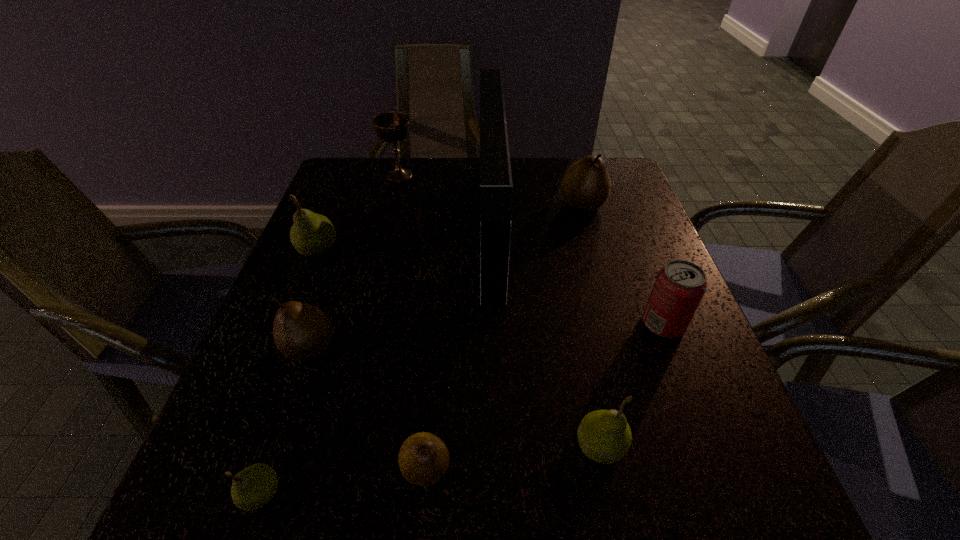
Identify which object is the second closest to the fifth object from right to left. Please provide its 2D coordinates. Your answer should be formatted as a tuple, i.e. [(x, y)], where the tuple contains the x and y coordinates of a point satisfying the conditions above.

[(604, 436)]

Where is `object that is the fourth closest one to the biggest brown pear`? object that is the fourth closest one to the biggest brown pear is located at coordinates (312, 234).

Choose which pear is the nearest neighbor to the smallest green pear. Please provide its 2D coordinates. Your answer should be formatted as a tuple, i.e. [(x, y)], where the tuple contains the x and y coordinates of a point satisfying the conditions above.

[(423, 459)]

I want to click on pear that is the closest to the rightmost brown pear, so click(312, 234).

Select which brown pear appears as the third closest to the nearest green pear. Please provide its 2D coordinates. Your answer should be formatted as a tuple, i.e. [(x, y)], where the tuple contains the x and y coordinates of a point satisfying the conditions above.

[(586, 185)]

Image resolution: width=960 pixels, height=540 pixels. In order to click on brown pear that can be found as the closest to the chalice in this screenshot , I will do `click(586, 185)`.

Select which green pear is the third closest to the rightmost brown pear. Please provide its 2D coordinates. Your answer should be formatted as a tuple, i.e. [(x, y)], where the tuple contains the x and y coordinates of a point satisfying the conditions above.

[(253, 487)]

Identify which green pear is the nearest to the second nearest green pear. Please provide its 2D coordinates. Your answer should be formatted as a tuple, i.e. [(x, y)], where the tuple contains the x and y coordinates of a point satisfying the conditions above.

[(253, 487)]

Identify the location of free space that satisfies the following two spatial constraints: 1. on the front side of the soda can; 2. on the left side of the chalice. This screenshot has height=540, width=960. (362, 323).

At what (x,y) coordinates should I click in order to perform the action: click on vacant space that satisfies the following two spatial constraints: 1. on the back side of the nearest brown pear; 2. on the right side of the farthest pear. Please return your answer as a coordinate pair (x, y). Looking at the image, I should click on (449, 204).